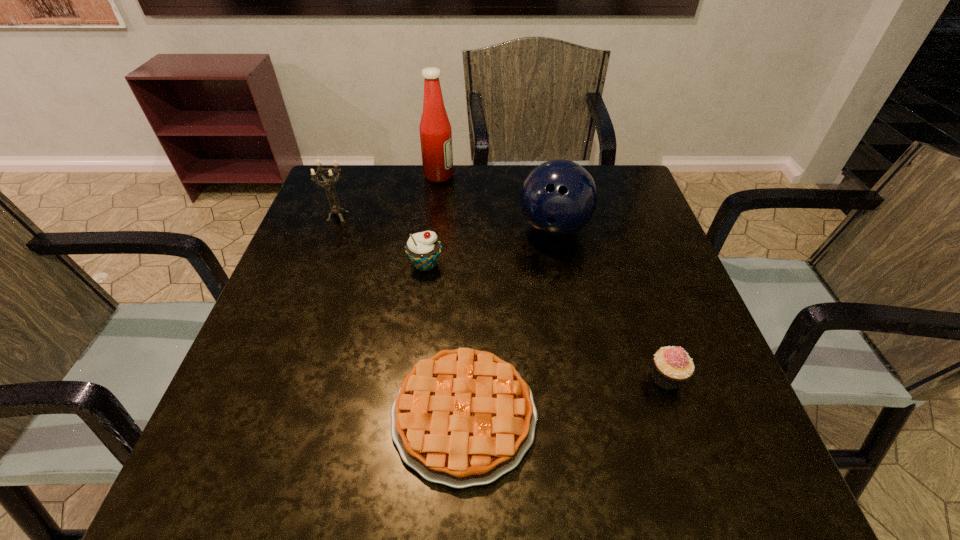
The width and height of the screenshot is (960, 540). Identify the location of object that is at the left edge. (335, 208).

The height and width of the screenshot is (540, 960). I want to click on object at the right edge, so click(672, 366).

Identify the location of object that is at the far left corner. (335, 208).

Find the location of `vacant region at the far edge of the desktop`. vacant region at the far edge of the desktop is located at coordinates (509, 197).

Identify the location of free space at the near edge of the desktop. [585, 484].

The width and height of the screenshot is (960, 540). I want to click on free location at the left edge of the desktop, so click(x=328, y=274).

Image resolution: width=960 pixels, height=540 pixels. Identify the location of free space at the right edge of the desktop. (644, 344).

I want to click on vacant area at the near left corner of the desktop, so click(295, 493).

At what (x,y) coordinates should I click in order to perform the action: click on vacant area between the rightmost object and the second tallest object. Please return your answer as a coordinate pair (x, y). This screenshot has height=540, width=960. Looking at the image, I should click on (610, 303).

The height and width of the screenshot is (540, 960). Identify the location of empty space between the right cupcake and the shortest object. (565, 396).